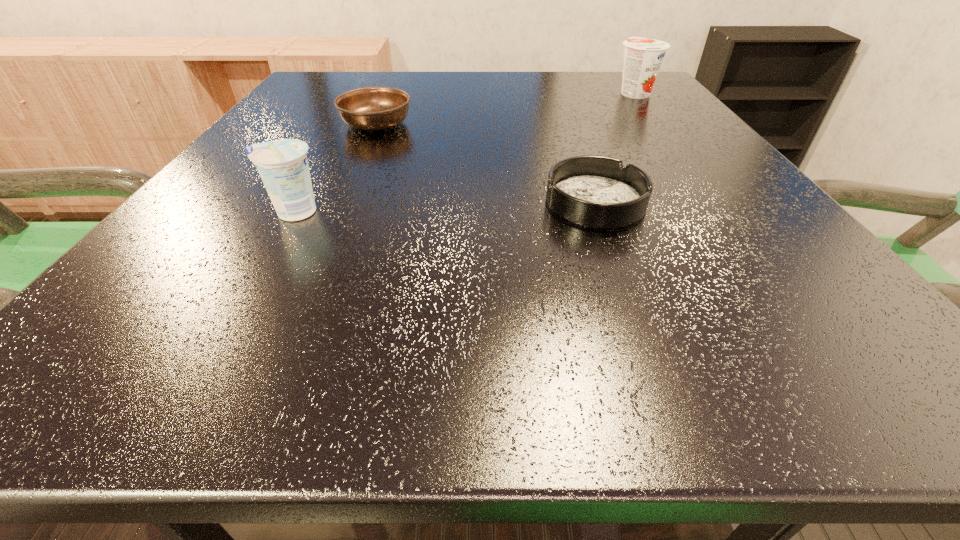
Locate an element on the screen. The image size is (960, 540). the rightmost object is located at coordinates point(643,57).

Where is `the right yogurt`? The image size is (960, 540). the right yogurt is located at coordinates 643,57.

The height and width of the screenshot is (540, 960). I want to click on the nearer yogurt, so click(282, 164).

I want to click on the third tallest object, so click(372, 108).

In order to click on soup bowl in this screenshot , I will do `click(372, 108)`.

Locate an element on the screen. the third object from left to right is located at coordinates (597, 192).

Where is `ashtray`? This screenshot has height=540, width=960. ashtray is located at coordinates (597, 192).

The width and height of the screenshot is (960, 540). I want to click on vacant space located 0.050m on the front of the right yogurt, so click(648, 110).

The height and width of the screenshot is (540, 960). Identify the location of free spot located on the right of the left yogurt. (561, 212).

The height and width of the screenshot is (540, 960). Find the location of `vacant space located on the front of the third tallest object`. vacant space located on the front of the third tallest object is located at coordinates (357, 167).